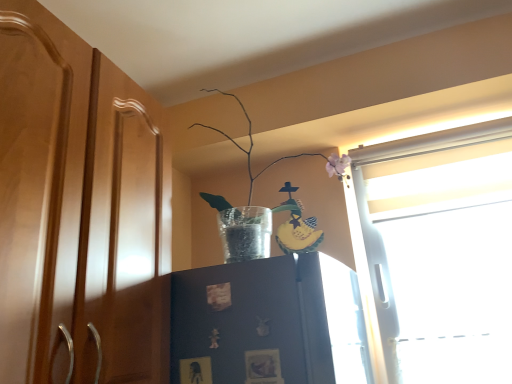
Question: Is clear glass vase at upper center oriented away from matte dark blue cabinet at center?

Choices:
 (A) no
 (B) yes

Answer: (A)

Question: Is clear glass vase at upper center to the left of matte dark blue cabinet at center from the viewer's perspective?

Choices:
 (A) no
 (B) yes

Answer: (A)

Question: Is clear glass vase at upper center wider than matte dark blue cabinet at center?

Choices:
 (A) yes
 (B) no

Answer: (A)

Question: Is clear glass vase at upper center at the right side of matte dark blue cabinet at center?

Choices:
 (A) no
 (B) yes

Answer: (B)

Question: Is clear glass vase at upper center outside of matte dark blue cabinet at center?

Choices:
 (A) no
 (B) yes

Answer: (B)

Question: From the image's perspective, is clear glass vase at upper center above or below matte wood dresser at center?

Choices:
 (A) below
 (B) above

Answer: (B)

Question: In the image, is clear glass vase at upper center positioned in front of or behind matte wood dresser at center?

Choices:
 (A) behind
 (B) front

Answer: (A)

Question: Based on their positions, is clear glass vase at upper center located to the left or right of matte wood dresser at center?

Choices:
 (A) right
 (B) left

Answer: (A)

Question: Looking at the image, does clear glass vase at upper center seem bigger or smaller compared to matte wood dresser at center?

Choices:
 (A) big
 (B) small

Answer: (B)

Question: Based on their positions, is matte wood dresser at center located to the left or right of matte dark blue cabinet at center?

Choices:
 (A) right
 (B) left

Answer: (B)

Question: Does point (35, 375) appear closer or farther from the camera than point (212, 302)?

Choices:
 (A) closer
 (B) farther

Answer: (A)

Question: From a real-world perspective, is matte wood dresser at center above or below matte dark blue cabinet at center?

Choices:
 (A) above
 (B) below

Answer: (A)

Question: Looking at the image, does matte wood dresser at center seem bigger or smaller compared to matte dark blue cabinet at center?

Choices:
 (A) big
 (B) small

Answer: (A)

Question: Is matte dark blue cabinet at center situated inside matte wood dresser at center or outside?

Choices:
 (A) inside
 (B) outside

Answer: (B)

Question: Looking at their shapes, would you say matte dark blue cabinet at center is wider or thinner than matte wood dresser at center?

Choices:
 (A) thin
 (B) wide

Answer: (A)